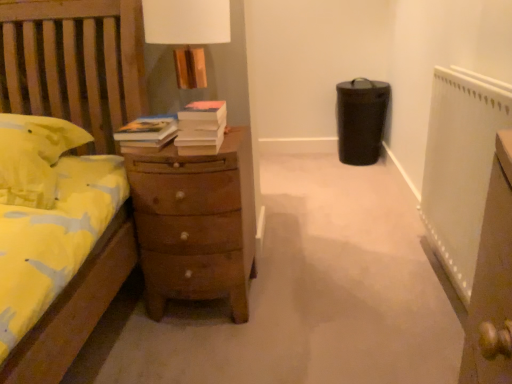
Question: Visually, is white textured radiator at right positioned to the left or to the right of brown wooden chest of drawers at center?

Choices:
 (A) left
 (B) right

Answer: (B)

Question: Considering the positions of point tap(482, 162) and point tap(165, 230), is point tap(482, 162) closer or farther from the camera than point tap(165, 230)?

Choices:
 (A) closer
 (B) farther

Answer: (A)

Question: Which of these objects is positioned farthest from the white textured radiator at right?

Choices:
 (A) white matte book at center
 (B) brown wooden chest of drawers at center

Answer: (A)

Question: Which object is positioned farthest from the white textured radiator at right?

Choices:
 (A) brown wooden chest of drawers at center
 (B) white matte book at center

Answer: (B)